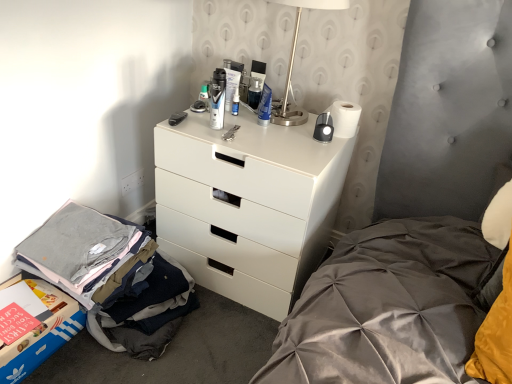
The image size is (512, 384). I want to click on vacant area that lies in front of translucent plastic bottle at upper center, marked as the fifth toiletry in a right-to-left arrangement, so click(208, 121).